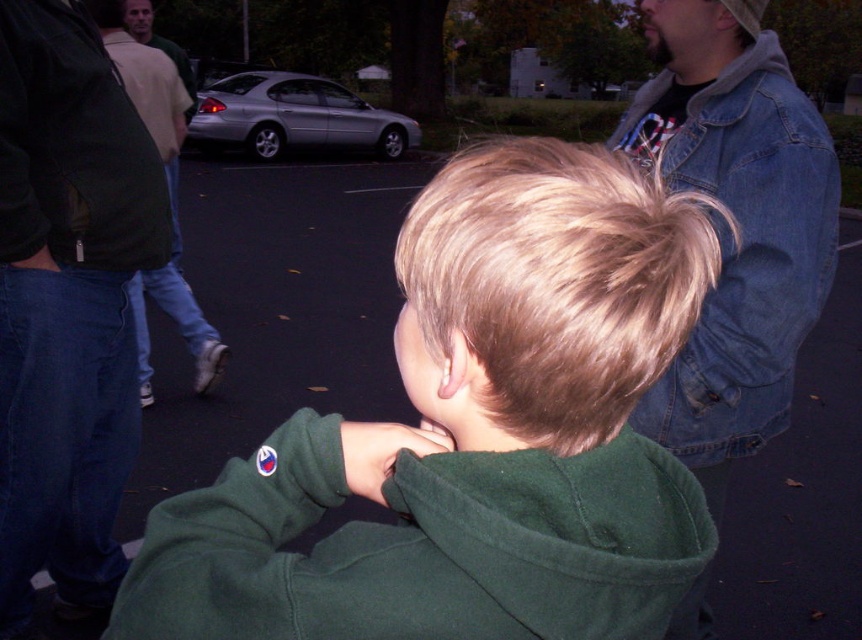
You are a photographer trying to capture a candid shot of the young boy in the scene. You want to ensure that both the green fleece jacket at center and the denim jacket at upper right are visible in the frame. Based on their positions, which jacket should you position closer to the left side of your camera viewfinder to include both in the shot?

The green fleece jacket at center is to the left of the denim jacket at upper right, so you should position the green fleece jacket at center closer to the left side of your camera viewfinder to include both in the shot.

You are standing at the point labeled point (73, 3) and want to walk to the point labeled point (678, 532). Which direction should you move in relation to the boy?

You should move towards the front of the boy because point (678, 532) is in front of point (73, 3).

You are a photographer trying to capture the perfect shot of the green fleece jacket at center. The camera you are using has a focal point grid divided into 9 equal squares. To ensure the jacket is centered in your photo, where should you position it on the grid? Please specify the coordinates as a pair of numbers between 0 and 1, representing the horizontal and vertical positions respectively.

The green fleece jacket at center is located at coordinates approximately 0.678 on the horizontal axis and 0.551 on the vertical axis. To center it in the photo, you should align the focal point grid to these coordinates, placing the jacket at the intersection point of the grid lines closest to these values.